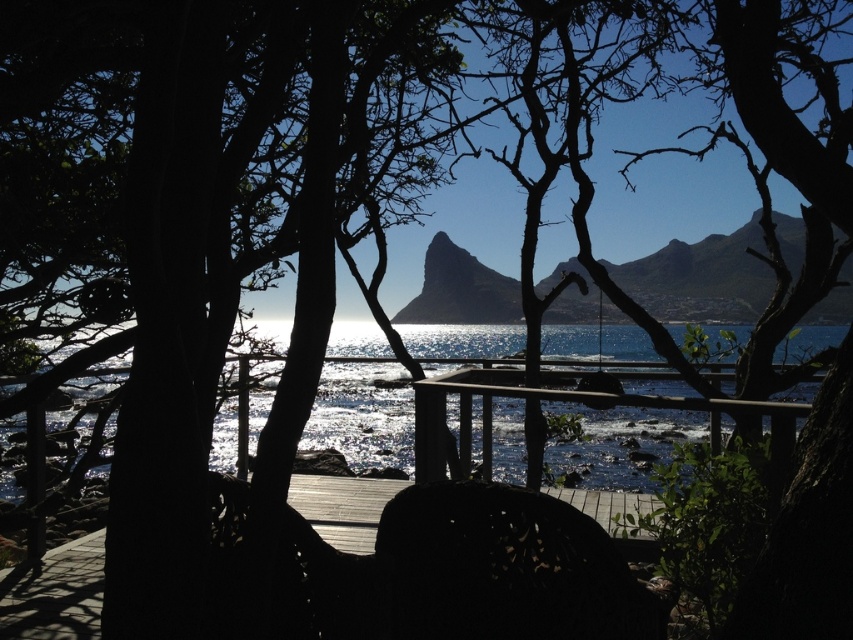
Is black matte chair at center behind dark wood deck at center?

No, black matte chair at center is in front of dark wood deck at center.

Between black matte chair at center and dark wood deck at center, which one has less height?

Standing shorter between the two is dark wood deck at center.

Between point (416, 628) and point (610, 504), which one is positioned in front?

Positioned in front is point (416, 628).

Where is `black matte chair at center`? The width and height of the screenshot is (853, 640). black matte chair at center is located at coordinates [x=503, y=568].

Can you confirm if black matte chair at center is shorter than translucent glass water at center?

Indeed, black matte chair at center has a lesser height compared to translucent glass water at center.

Who is more distant from viewer, (634, 630) or (4, 490)?

Point (4, 490)

You are a GUI agent. You are given a task and a screenshot of the screen. Output one action in this format:
    pyautogui.click(x=<x>, y=<y>)
    Task: Click on the black matte chair at center
    The width and height of the screenshot is (853, 640).
    Given the screenshot: What is the action you would take?
    pyautogui.click(x=503, y=568)

Measure the distance between point (828, 333) and camera.

Point (828, 333) and camera are 20.39 feet apart.

How distant is translucent glass water at center from dark wood deck at center?

translucent glass water at center is 7.56 feet away from dark wood deck at center.

Is point (454, 349) positioned before point (86, 541)?

No, it is not.

Find the location of a particular element. The image size is (853, 640). translucent glass water at center is located at coordinates (363, 417).